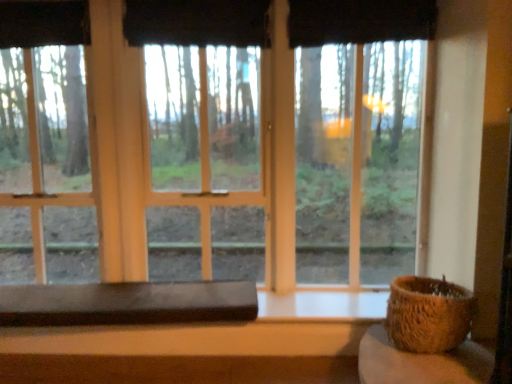
Question: Is brown woven basket at right wider than transparent glass window at center?

Choices:
 (A) yes
 (B) no

Answer: (A)

Question: Is the position of brown woven basket at right less distant than that of transparent glass window at center?

Choices:
 (A) yes
 (B) no

Answer: (A)

Question: Does brown woven basket at right have a larger size compared to transparent glass window at center?

Choices:
 (A) yes
 (B) no

Answer: (B)

Question: Could you tell me if brown woven basket at right is facing transparent glass window at center?

Choices:
 (A) yes
 (B) no

Answer: (B)

Question: Considering the relative positions of brown woven basket at right and transparent glass window at center in the image provided, is brown woven basket at right to the right of transparent glass window at center from the viewer's perspective?

Choices:
 (A) yes
 (B) no

Answer: (A)

Question: Is transparent glass window at center inside the boundaries of brown woven basket at right, or outside?

Choices:
 (A) inside
 (B) outside

Answer: (B)

Question: From their relative heights in the image, would you say transparent glass window at center is taller or shorter than brown woven basket at right?

Choices:
 (A) tall
 (B) short

Answer: (A)

Question: Does point (186, 266) appear closer or farther from the camera than point (446, 307)?

Choices:
 (A) closer
 (B) farther

Answer: (B)

Question: In terms of width, does transparent glass window at center look wider or thinner when compared to brown woven basket at right?

Choices:
 (A) wide
 (B) thin

Answer: (B)

Question: From their relative heights in the image, would you say black fabric curtain at upper center, which ranks as the second curtain in left-to-right order, is taller or shorter than brown woven basket at right?

Choices:
 (A) tall
 (B) short

Answer: (B)

Question: In terms of width, does black fabric curtain at upper center, which ranks as the second curtain in left-to-right order, look wider or thinner when compared to brown woven basket at right?

Choices:
 (A) thin
 (B) wide

Answer: (A)

Question: Does point (338, 41) appear closer or farther from the camera than point (446, 317)?

Choices:
 (A) closer
 (B) farther

Answer: (B)

Question: Is black fabric curtain at upper center, the first curtain viewed from the right, bigger or smaller than brown woven basket at right?

Choices:
 (A) small
 (B) big

Answer: (A)

Question: In terms of size, does white matte window sill at lower center appear bigger or smaller than black fabric curtain at upper center, the second curtain from the right?

Choices:
 (A) big
 (B) small

Answer: (B)

Question: Is point (315, 296) closer or farther from the camera than point (42, 13)?

Choices:
 (A) closer
 (B) farther

Answer: (A)